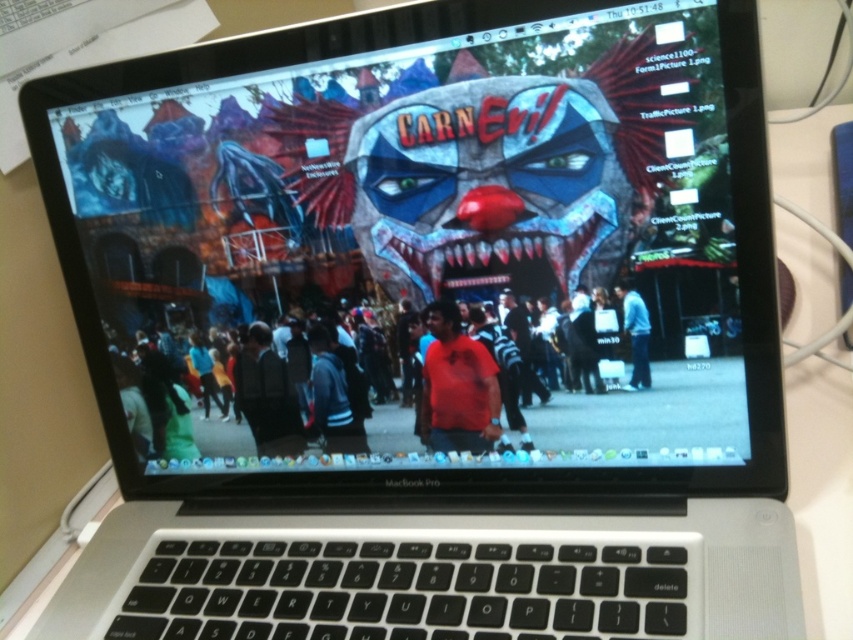
You are looking at the MacBook Pro screen and notice two people in the crowd at the center. One is wearing a red shirt at center and the other blue denim jeans at center. From your perspective, which clothing item is positioned more to the left?

The red shirt at center is positioned to the left of the blue denim jeans at center, so the red shirt at center is more to the left.

You are looking at the MacBook Pro screen. There is a point labeled at coordinates (375, 372). What is located at that point?

The point at (375, 372) indicates the location of the red shirt at center.

You are a photographer standing in front of the MacBook Pro screen. You notice two items at the center of the scene, the red shirt at center and the blue denim jeans at center. Which one appears bigger to you?

The red shirt at center is larger in size than the blue denim jeans at center, so the red shirt at center appears bigger.